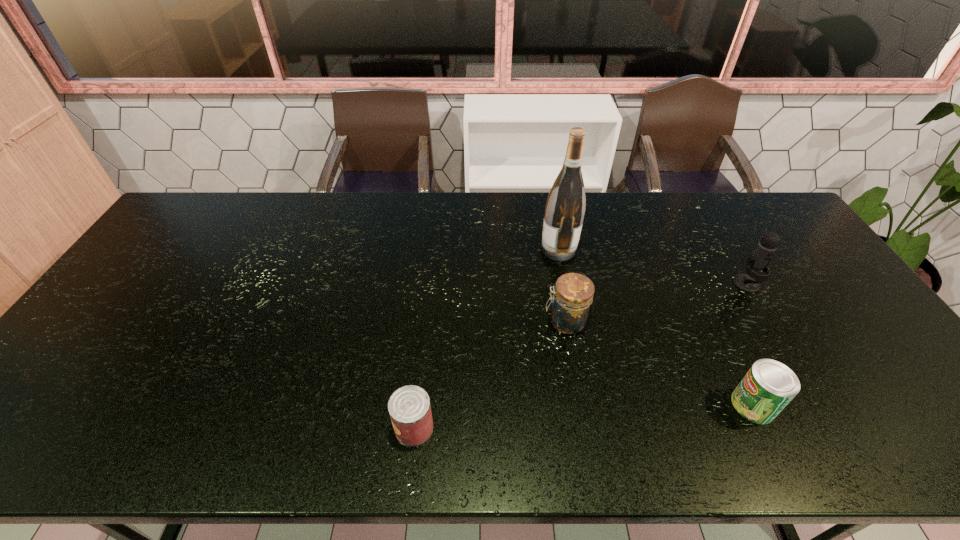
Find the location of a particular element. the tallest object is located at coordinates (564, 212).

Identify the location of the farthest object. The image size is (960, 540). (564, 212).

Identify the location of the fourth nearest object. This screenshot has height=540, width=960. (761, 256).

In order to click on microphone in this screenshot , I will do `click(761, 256)`.

Where is `the third tallest object`? Image resolution: width=960 pixels, height=540 pixels. the third tallest object is located at coordinates (570, 308).

Where is `the third nearest object`? the third nearest object is located at coordinates (570, 308).

You are a GUI agent. You are given a task and a screenshot of the screen. Output one action in this format:
    pyautogui.click(x=<x>, y=<y>)
    Task: Click on the second object from right to left
    
    Given the screenshot: What is the action you would take?
    pyautogui.click(x=767, y=388)

Identify the location of the leftmost object. This screenshot has height=540, width=960. (409, 407).

Where is `vacant area located on the label of the tallest object`? vacant area located on the label of the tallest object is located at coordinates (513, 249).

Where is `free region located on the label of the tallest object`? Image resolution: width=960 pixels, height=540 pixels. free region located on the label of the tallest object is located at coordinates (416, 249).